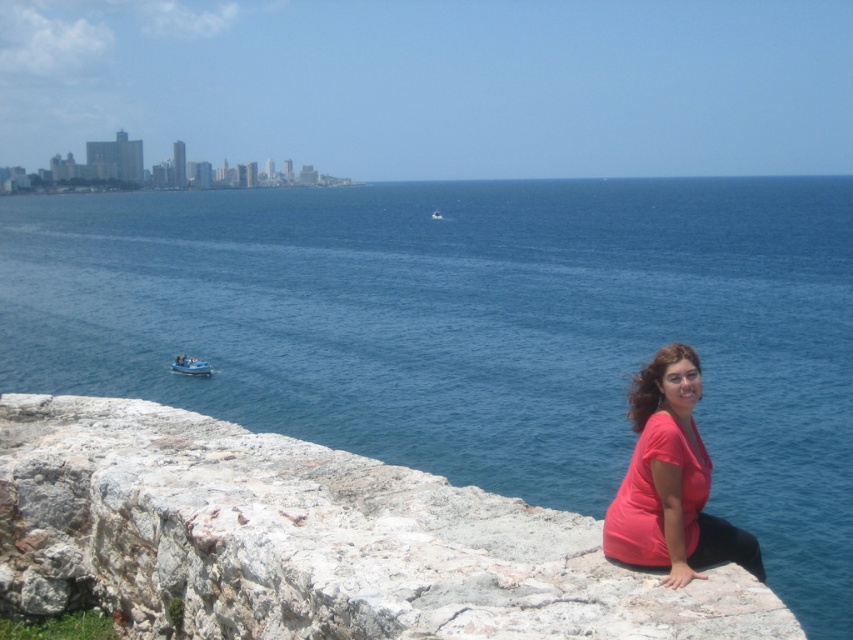
In the scene shown: You are a photographer aiming to capture the blue water at center in the image. Based on its position, can you determine if it will be visible in the lower half of the photo?

The blue water at center is located at point coordinates of 0.519 on the x axis and 0.559 on the y axis. Since the y coordinate is above 0.5, it is positioned in the upper half of the image, so it will not be visible in the lower half of the photo.

You are a photographer standing in front of the scenic coastal view. You notice the blue water at center and the matte pink shirt at lower right in your camera frame. Which object appears taller in the image?

The blue water at center appears taller than the matte pink shirt at lower right in the image.